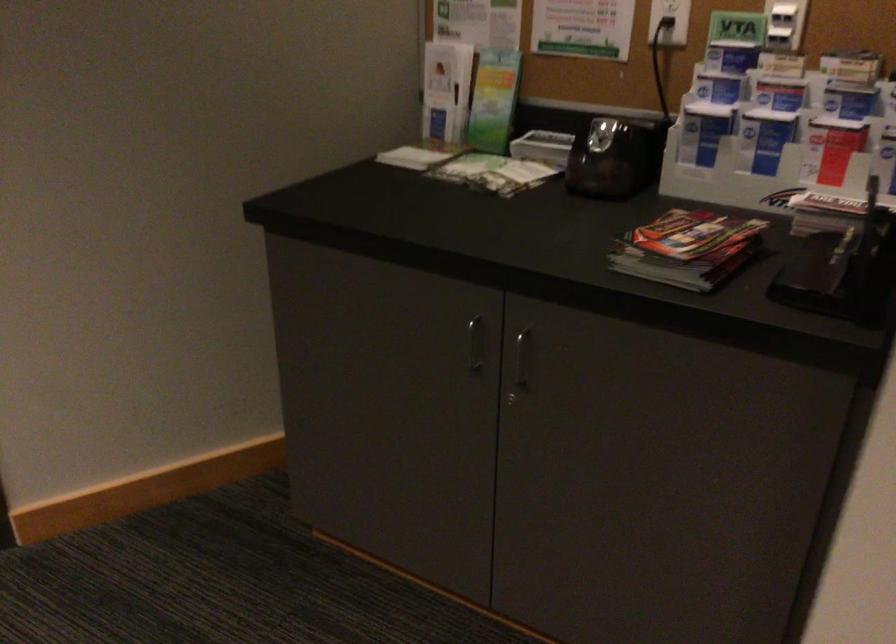
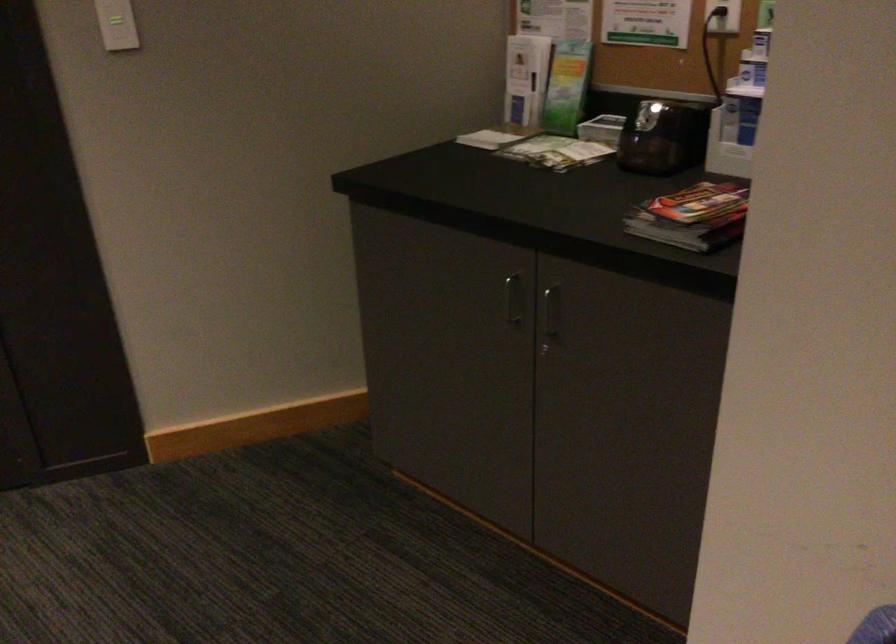
Question: The camera is either moving clockwise (left) or counter-clockwise (right) around the object. The first image is from the beginning of the video and the second image is from the end. Is the camera moving left or right when shooting the video?

Choices:
 (A) Left
 (B) Right

Answer: (B)